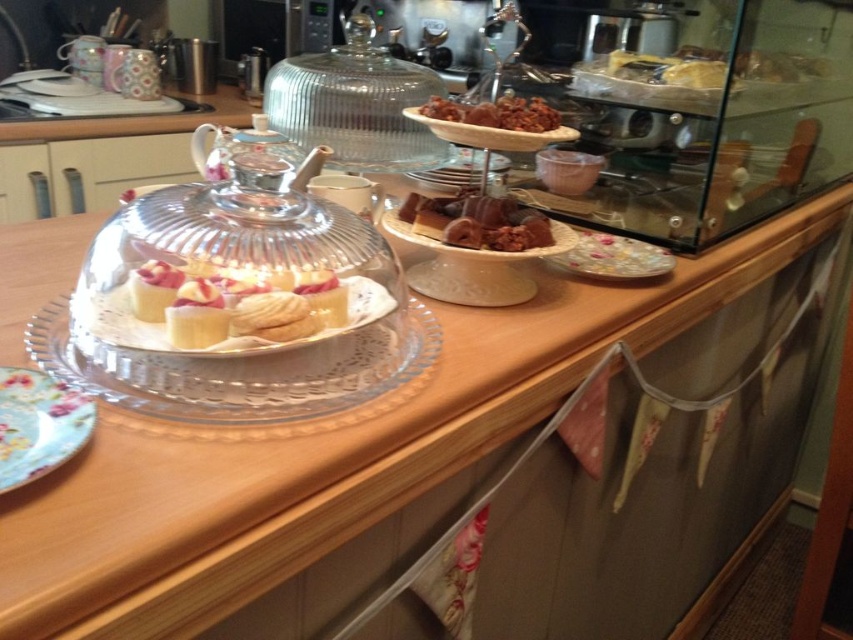
Question: Does floral paper plate at lower left have a larger size compared to white porcelain plate at center?

Choices:
 (A) no
 (B) yes

Answer: (A)

Question: Based on their relative distances, which object is farther from the transparent glass teapot at center?

Choices:
 (A) floral paper plate at lower left
 (B) clear glass cake stand at center

Answer: (A)

Question: Can you confirm if white porcelain plate at center is thinner than transparent glass teapot at center?

Choices:
 (A) no
 (B) yes

Answer: (B)

Question: Which object appears farthest from the camera in this image?

Choices:
 (A) white porcelain plate at center
 (B) porcelain plate at center
 (C) floral paper plate at lower left
 (D) clear glass cake stand at center

Answer: (B)

Question: Which point appears farthest from the camera in this image?

Choices:
 (A) (425, 234)
 (B) (267, 134)
 (C) (54, 232)
 (D) (372, 321)

Answer: (C)

Question: Does porcelain plate at center appear on the right side of chocolate-coated nuts at center?

Choices:
 (A) no
 (B) yes

Answer: (B)